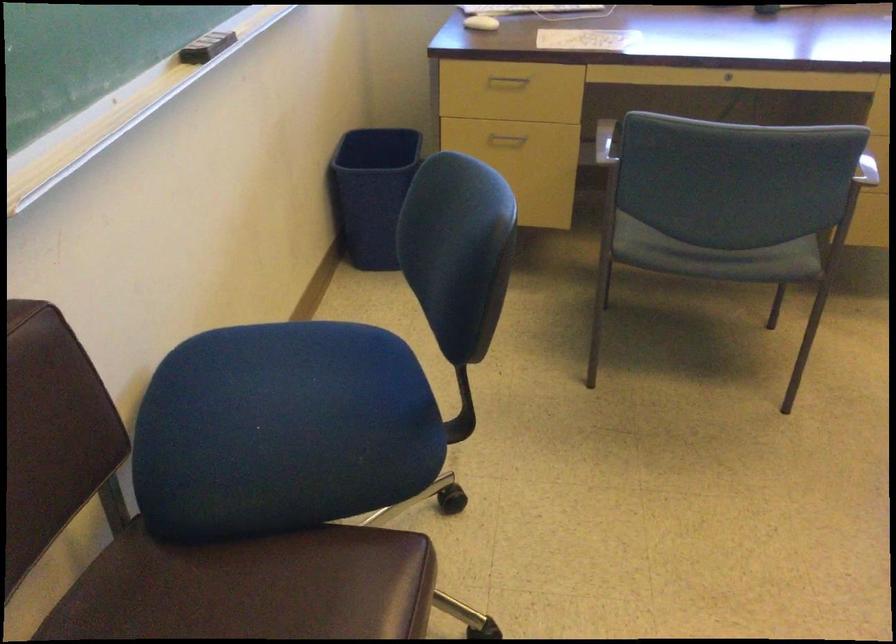
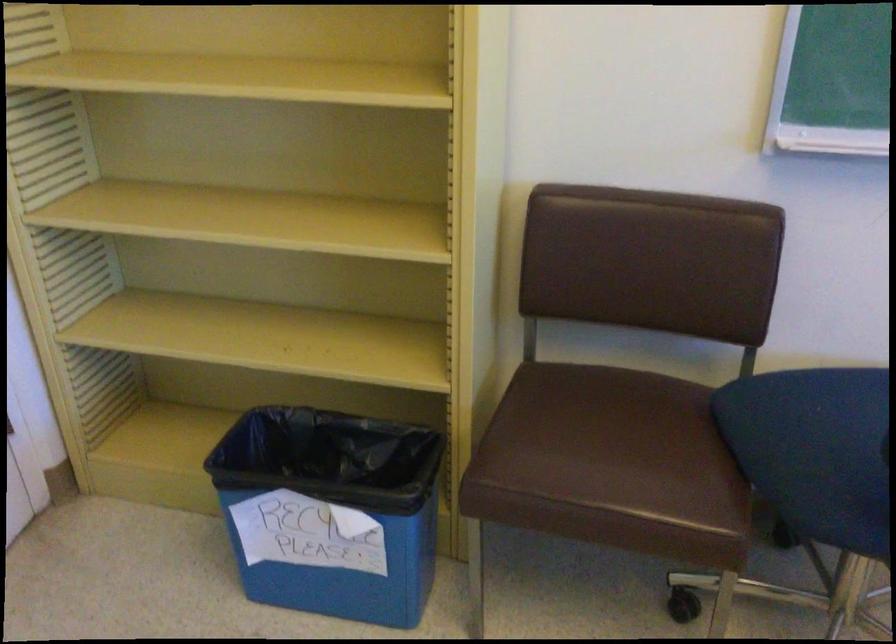
The point at (340, 448) is marked in the first image. Where is the corresponding point in the second image?

(814, 450)